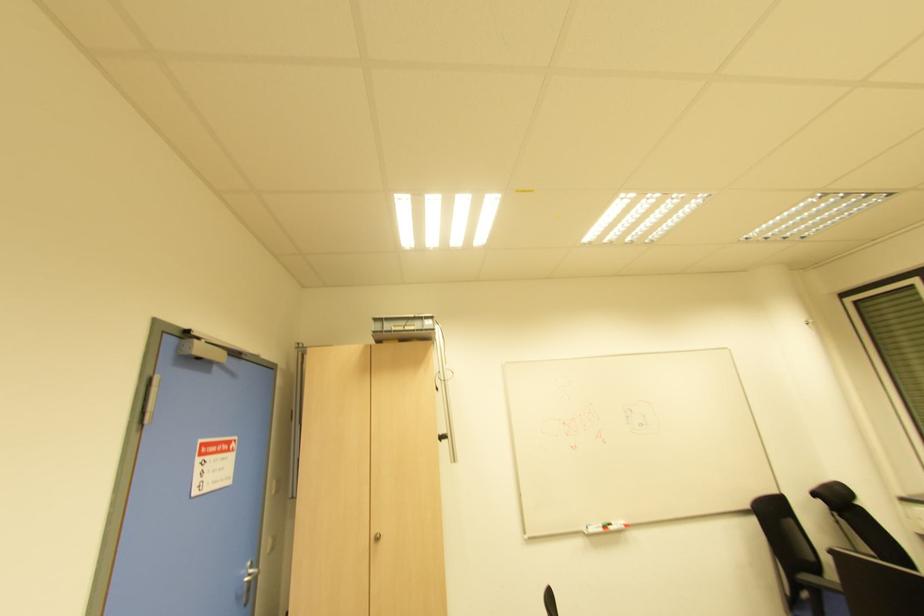
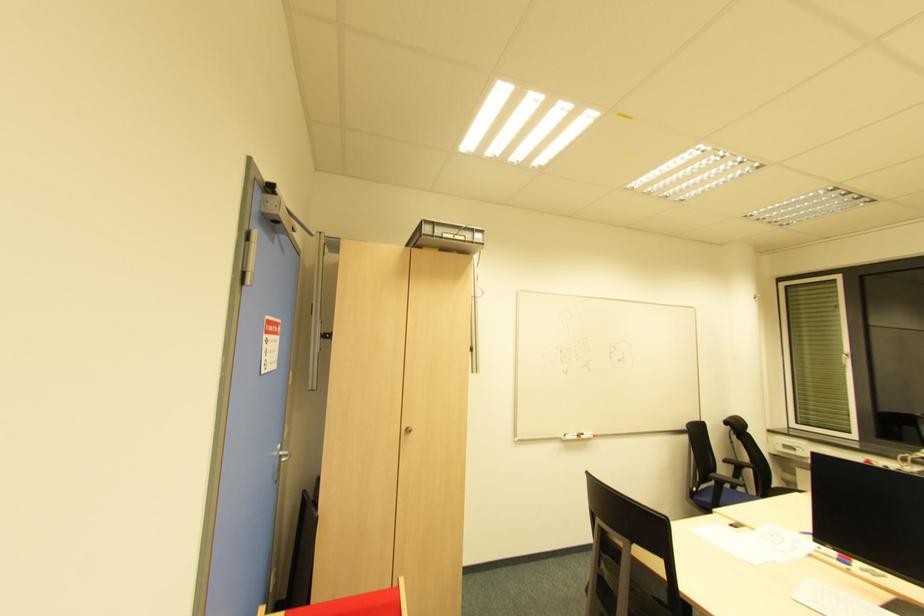
Question: In a continuous first-person perspective shot, in which direction is the camera moving?

Choices:
 (A) Left
 (B) Right
 (C) Forward
 (D) Backward

Answer: (A)